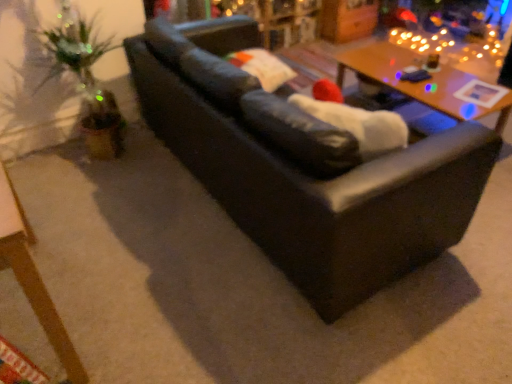
Find the location of a particular element. vacant area located to the right-hand side of wooden table at lower left, acting as the second table starting from the back is located at coordinates (156, 292).